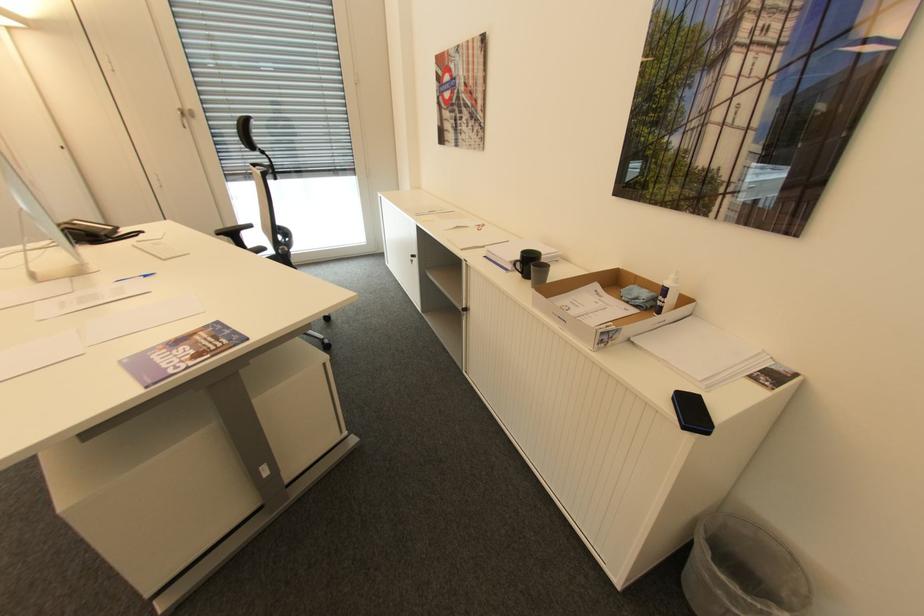
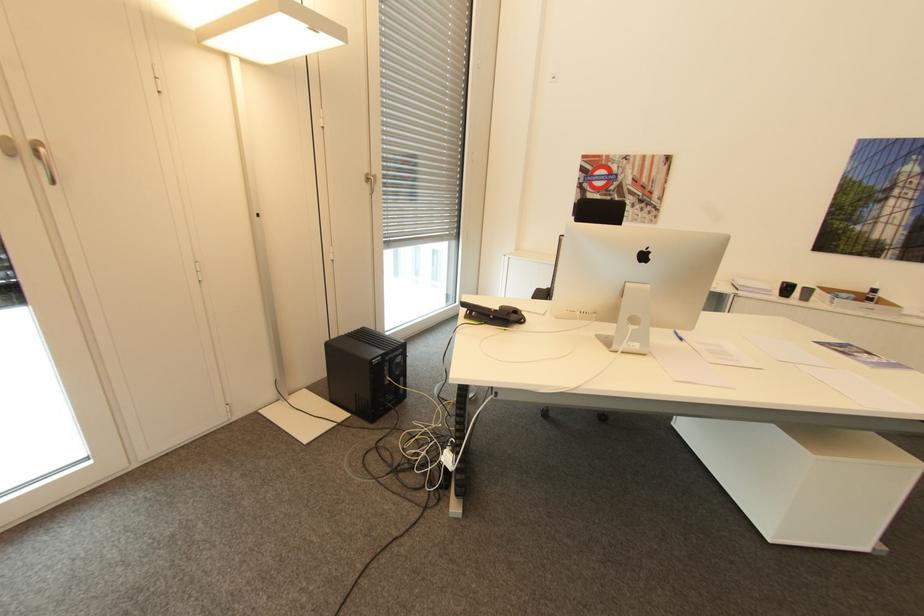
The point at (670,291) is marked in the first image. Where is the corresponding point in the second image?

(879, 290)